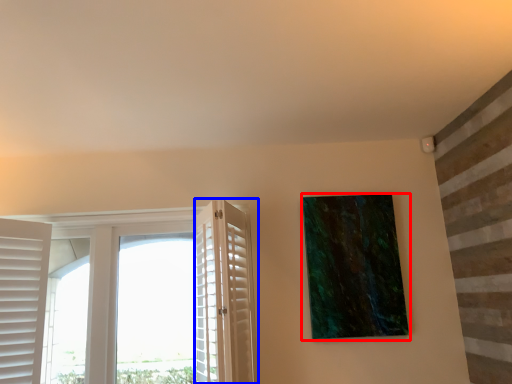
Question: Which object appears farthest to the camera in this image, picture frame (highlighted by a red box) or screen door (highlighted by a blue box)?

Choices:
 (A) picture frame
 (B) screen door

Answer: (A)